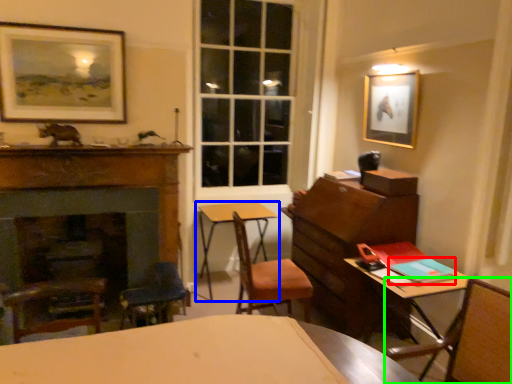
Question: Which object is positioned closest to book (highlighted by a red box)? Select from table (highlighted by a blue box) and chair (highlighted by a green box).

Choices:
 (A) table
 (B) chair

Answer: (B)